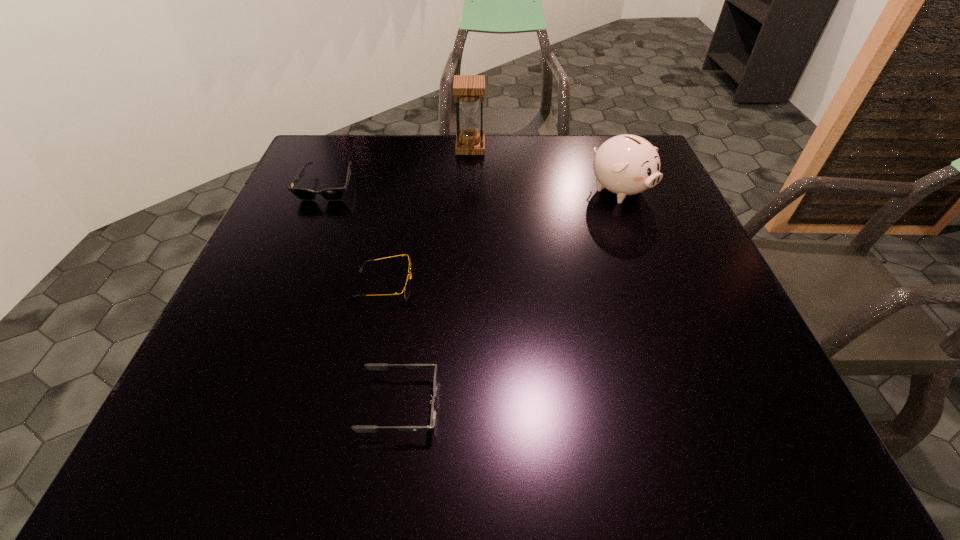
Identify the location of hourglass. coord(468,88).

The height and width of the screenshot is (540, 960). I want to click on the tallest object, so click(468, 88).

This screenshot has width=960, height=540. Identify the location of piggy bank. (626, 164).

Where is `the fourth shortest object`? This screenshot has width=960, height=540. the fourth shortest object is located at coordinates (626, 164).

I want to click on the leftmost sunglasses, so pos(332,194).

I want to click on the leftmost object, so click(332, 194).

Where is `the second nearest sunglasses`? The height and width of the screenshot is (540, 960). the second nearest sunglasses is located at coordinates (407, 287).

Where is `the nearest sunglasses`? the nearest sunglasses is located at coordinates (371, 366).

At what (x,y) coordinates should I click in order to perform the action: click on free location located 0.380m on the left of the hourglass. Please return your answer as a coordinate pair (x, y). Looking at the image, I should click on (326, 147).

This screenshot has height=540, width=960. I want to click on vacant space located on the front of the rightmost object, so click(639, 244).